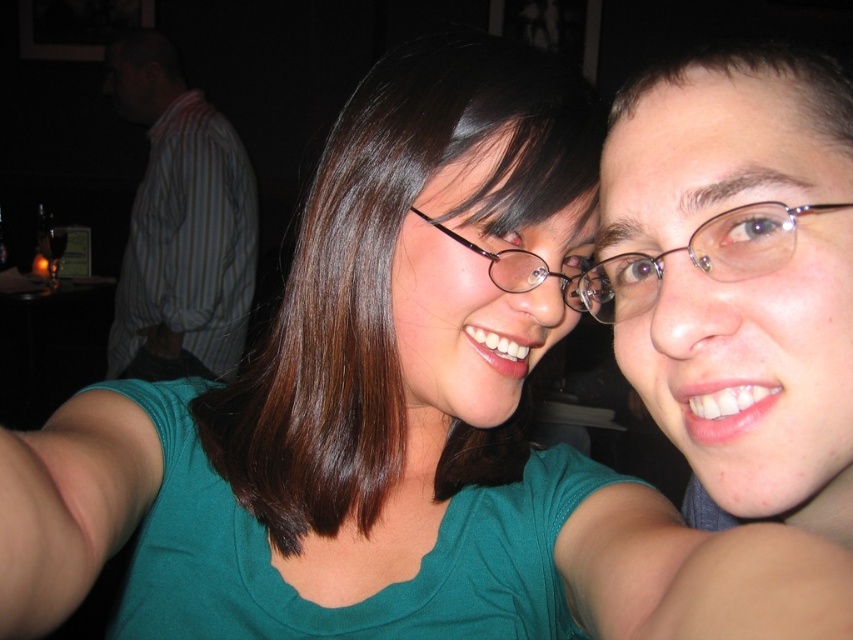
You are a photographer trying to capture a closeup shot of the brown hair at center and the pink flesh at lower right. Which object is wider in the image?

The brown hair at center is wider than the pink flesh at lower right according to the description.

You are trying to decide whether to place a small decorative plant between the striped shirt at upper left and the brown hair at upper right in the image. Given their heights, will the plant be visible to both people?

The striped shirt at upper left is much taller than brown hair at upper right. The plant placed between them might be visible to both, but since the striped shirt is taller, it could block the plant from the view of the brown hair at upper right depending on their exact positions.

You are a photographer trying to adjust the lighting for a portrait. You notice the brown hair at center and the pink flesh at lower right in your frame. Which object should you focus on to ensure proper exposure if the larger object requires more light?

The brown hair at center requires more light since it has a larger size compared to the pink flesh at lower right.